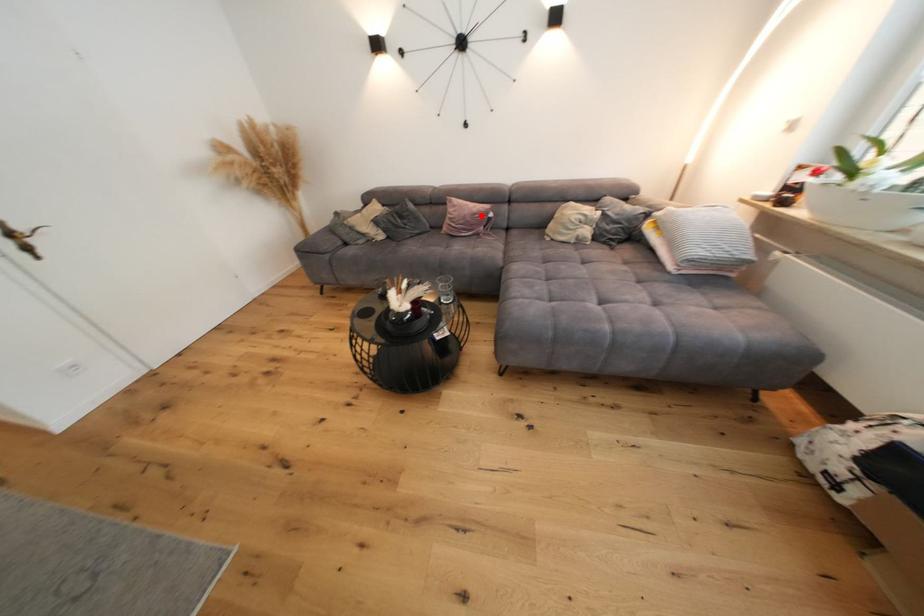
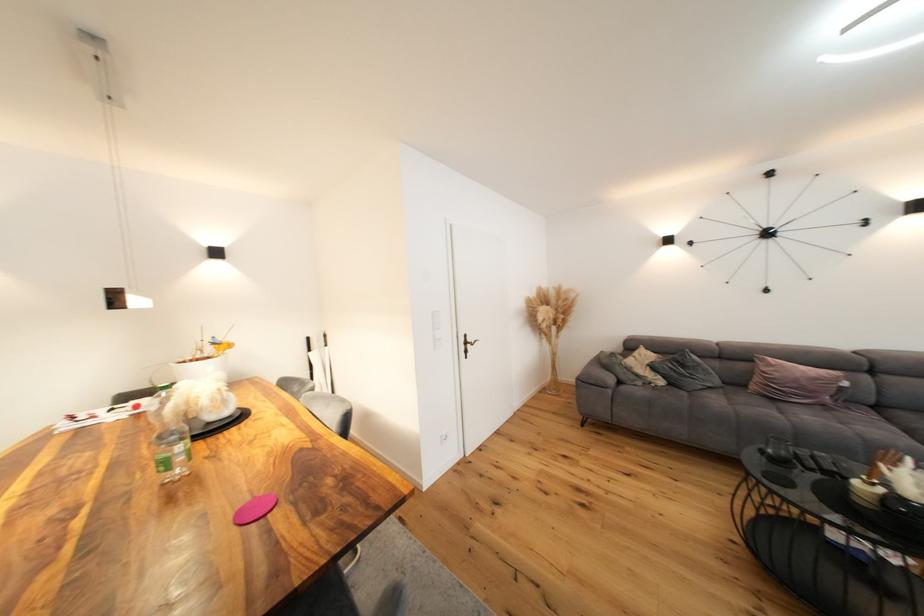
In the second image, find the point that corresponds to the highlighted location in the first image.

(822, 381)